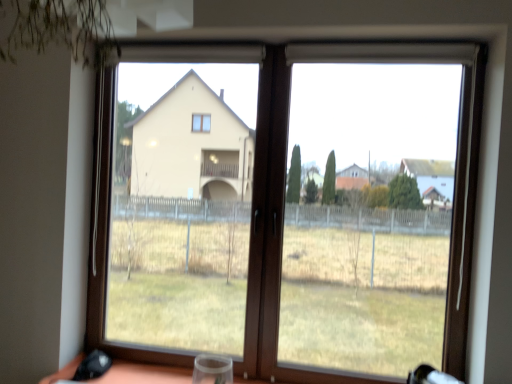
Question: Considering the relative positions of brown wooden window at center and transparent plastic wine glass at bottom center in the image provided, is brown wooden window at center to the right of transparent plastic wine glass at bottom center from the viewer's perspective?

Choices:
 (A) yes
 (B) no

Answer: (A)

Question: Does brown wooden window at center have a greater width compared to transparent plastic wine glass at bottom center?

Choices:
 (A) no
 (B) yes

Answer: (A)

Question: From a real-world perspective, is brown wooden window at center physically above transparent plastic wine glass at bottom center?

Choices:
 (A) no
 (B) yes

Answer: (B)

Question: Is brown wooden window at center aimed at transparent plastic wine glass at bottom center?

Choices:
 (A) yes
 (B) no

Answer: (A)

Question: From the image's perspective, is brown wooden window at center located above transparent plastic wine glass at bottom center?

Choices:
 (A) no
 (B) yes

Answer: (B)

Question: Is brown wooden window at center to the left of transparent plastic wine glass at bottom center from the viewer's perspective?

Choices:
 (A) no
 (B) yes

Answer: (A)

Question: From the image's perspective, is transparent plastic wine glass at bottom center located beneath brown wooden window at center?

Choices:
 (A) no
 (B) yes

Answer: (B)

Question: Could brown wooden window at center be considered to be inside transparent plastic wine glass at bottom center?

Choices:
 (A) yes
 (B) no

Answer: (B)

Question: Does transparent plastic wine glass at bottom center lie behind brown wooden window at center?

Choices:
 (A) yes
 (B) no

Answer: (B)

Question: Considering the relative sizes of transparent plastic wine glass at bottom center and brown wooden window at center in the image provided, is transparent plastic wine glass at bottom center shorter than brown wooden window at center?

Choices:
 (A) yes
 (B) no

Answer: (A)

Question: Does transparent plastic wine glass at bottom center appear on the right side of brown wooden window at center?

Choices:
 (A) no
 (B) yes

Answer: (A)

Question: Is transparent plastic wine glass at bottom center positioned with its back to brown wooden window at center?

Choices:
 (A) no
 (B) yes

Answer: (B)

Question: From a real-world perspective, relative to brown wooden window at center, is transparent plastic wine glass at bottom center vertically above or below?

Choices:
 (A) above
 (B) below

Answer: (B)